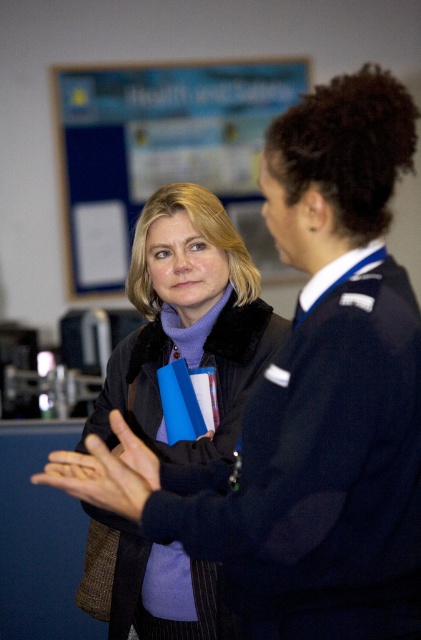
You are an office worker who needs to hang a new notice on the bulletin board. You have a 15cm wide notice. The blue paperboard at upper center and the matte black hand at center are in your way. Which object do you need to move to make space for the notice?

The blue paperboard at upper center is larger in size than the matte black hand at center, so you should move the blue paperboard at upper center to make space for the notice.

You are standing in an office and see a point at coordinates (165, 243). If you want to place a 2.5 feet wide poster on the wall at that point, will it fit without overlapping other objects?

The distance of point (165, 243) from camera is 5.77 feet, so the poster can be placed there as there is enough space. However, ensure no other objects are nearby at that point to avoid overlap.

You are an office assistant who needs to hang a new poster on the bulletin board. The poster is exactly the same height as the blue paperboard at upper center. Will the matte black hand at center interfere with hanging the poster?

The blue paperboard at upper center is taller than the matte black hand at center, so the poster will extend above the hand and may not interfere. However, ensure the hand isn not in the way when hanging.